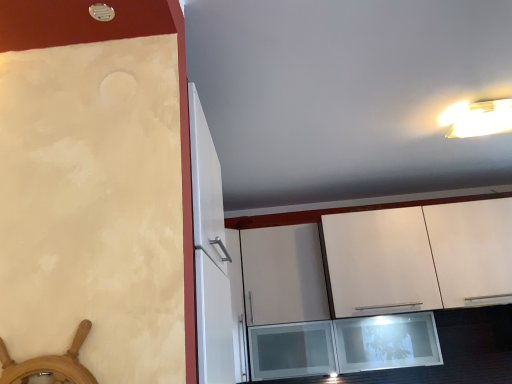
Question: Does white matte cabinet at upper center have a lesser width compared to white plastic light fixture at upper right?

Choices:
 (A) yes
 (B) no

Answer: (B)

Question: Is white matte cabinet at upper center positioned in front of white plastic light fixture at upper right?

Choices:
 (A) yes
 (B) no

Answer: (B)

Question: Does white matte cabinet at upper center appear on the right side of white plastic light fixture at upper right?

Choices:
 (A) no
 (B) yes

Answer: (A)

Question: Is white matte cabinet at upper center outside white plastic light fixture at upper right?

Choices:
 (A) no
 (B) yes

Answer: (B)

Question: Does white matte cabinet at upper center turn towards white plastic light fixture at upper right?

Choices:
 (A) yes
 (B) no

Answer: (A)

Question: Is white matte cabinet at upper center turned away from white plastic light fixture at upper right?

Choices:
 (A) no
 (B) yes

Answer: (A)

Question: Is white plastic light fixture at upper right in front of white matte cabinet at upper center?

Choices:
 (A) no
 (B) yes

Answer: (B)

Question: Are white plastic light fixture at upper right and white matte cabinet at upper center located far from each other?

Choices:
 (A) yes
 (B) no

Answer: (B)

Question: From the image's perspective, does white plastic light fixture at upper right appear higher than white matte cabinet at upper center?

Choices:
 (A) no
 (B) yes

Answer: (B)

Question: Would you say white plastic light fixture at upper right contains white matte cabinet at upper center?

Choices:
 (A) yes
 (B) no

Answer: (B)

Question: Does white plastic light fixture at upper right have a greater height compared to white matte cabinet at upper center?

Choices:
 (A) no
 (B) yes

Answer: (A)

Question: Could you tell me if white plastic light fixture at upper right is facing white matte cabinet at upper center?

Choices:
 (A) yes
 (B) no

Answer: (B)

Question: Is white matte cabinet at upper center spatially inside white plastic light fixture at upper right, or outside of it?

Choices:
 (A) outside
 (B) inside

Answer: (A)